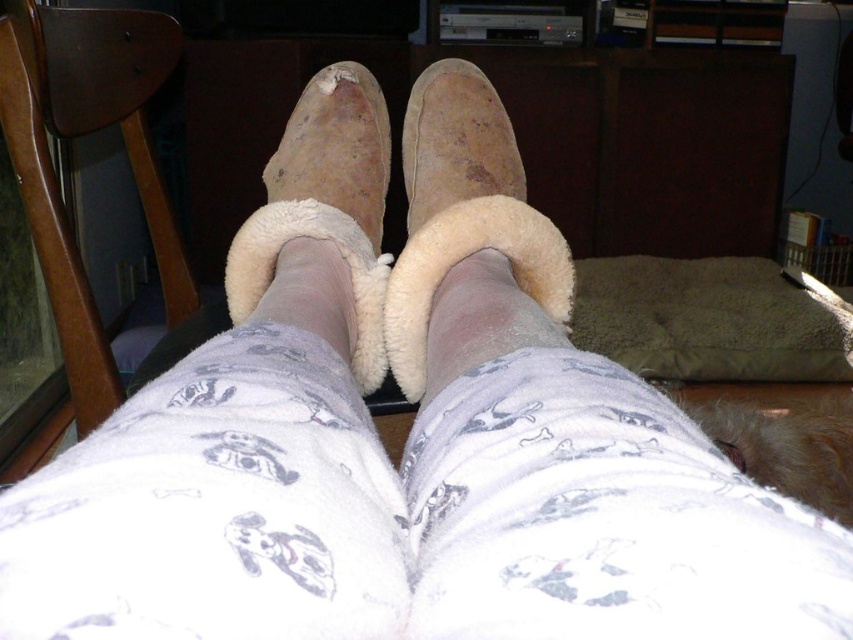
Question: Which of the following is the farthest from the observer?

Choices:
 (A) white fluffy socks at center
 (B) suede/sheepskin boot at center

Answer: (B)

Question: Does brown wood chair at left have a smaller size compared to suede-like tan boot at center?

Choices:
 (A) yes
 (B) no

Answer: (B)

Question: Estimate the real-world distances between objects in this image. Which object is closer to the brown wood chair at left?

Choices:
 (A) white fleece sock at center
 (B) suede/sheepskin boot at center

Answer: (B)

Question: Which point is farther to the camera?

Choices:
 (A) (457, 326)
 (B) (39, 237)
 (C) (337, 72)

Answer: (B)

Question: Is fuzzy white socks at center to the right of suede-like tan boot at center from the viewer's perspective?

Choices:
 (A) no
 (B) yes

Answer: (B)

Question: Is fuzzy white socks at center below white fleece sock at center?

Choices:
 (A) no
 (B) yes

Answer: (A)